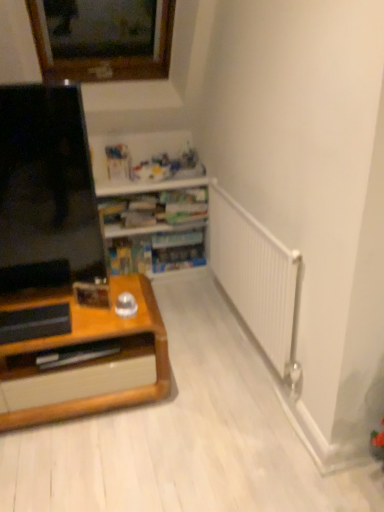
Identify the location of free location in front of wooden bookshelf at center. (180, 304).